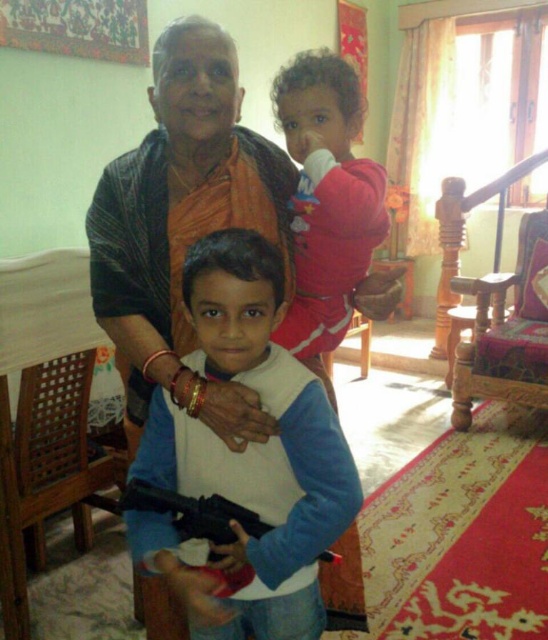
Does orange saree at center appear over black plastic gun at center?

Yes.

Is point (236, 86) farther from viewer compared to point (267, 525)?

Yes, point (236, 86) is farther from viewer.

Who is more forward, (x=92, y=285) or (x=147, y=490)?

Point (x=147, y=490)

Identify the location of orange saree at center. This screenshot has width=548, height=640. (182, 225).

Based on the photo, measure the distance from orange saree at center to fluffy pink sweater at upper right.

A distance of 7.92 inches exists between orange saree at center and fluffy pink sweater at upper right.

Which is more to the right, orange saree at center or fluffy pink sweater at upper right?

From the viewer's perspective, fluffy pink sweater at upper right appears more on the right side.

Which is behind, point (218, 134) or point (339, 116)?

Positioned behind is point (339, 116).

Identify the location of orange saree at center. The width and height of the screenshot is (548, 640). (182, 225).

Who is positioned more to the right, white matte vest at center or black plastic gun at center?

Positioned to the right is black plastic gun at center.

Is white matte vest at center closer to camera compared to black plastic gun at center?

Yes, it is in front of black plastic gun at center.

Which is behind, point (172, 520) or point (328, 554)?

Positioned behind is point (328, 554).

Image resolution: width=548 pixels, height=640 pixels. In order to click on white matte vest at center in this screenshot , I will do `click(246, 458)`.